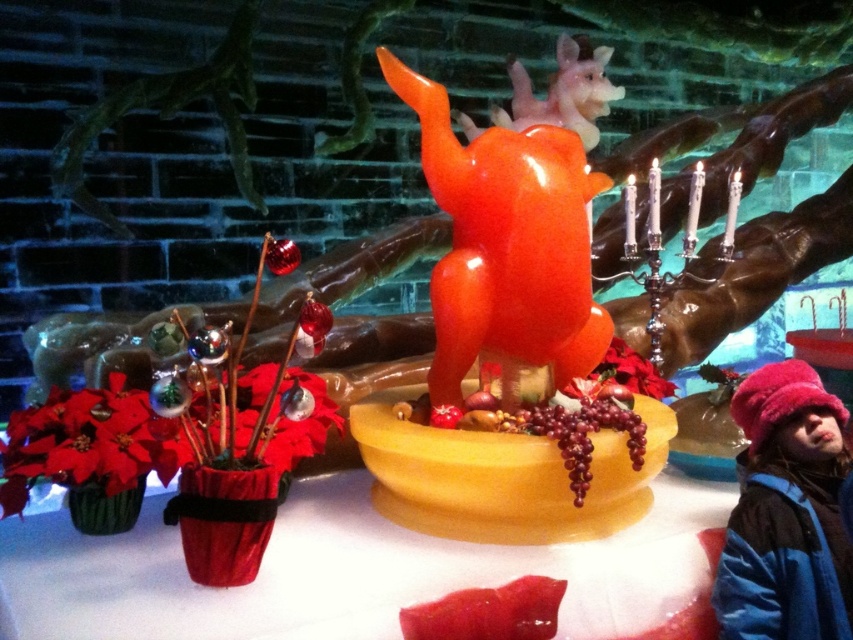
You are a photographer setting up a shot of the festive scene. You want to ensure the translucent yellow bowl at center and the glossy plastic reindeer at upper center are both clearly visible. Which object should you focus on first to ensure depth of field captures both?

The translucent yellow bowl at center is in front of the glossy plastic reindeer at upper center. To ensure both are in focus, you should focus on the glossy plastic reindeer at upper center since it is further away, allowing the foreground object to remain sharp as well.

You are standing in front of the festive display and want to take a photo of the translucent yellow bowl at center. If your camera has a minimum focus distance of 1.2 meters, will you be able to focus on the bowl without moving closer?

The translucent yellow bowl at center is 1.19 meters from the camera, which is within the camera minimum focus distance of 1.2 meters. Therefore, you can focus on the bowl without moving closer.

You are an interior designer arranging a holiday display. You have a glossy plastic reindeer at upper center and a poinsettia matte at center. Which object is placed above the other?

The glossy plastic reindeer at upper center is positioned over poinsettia matte at center.